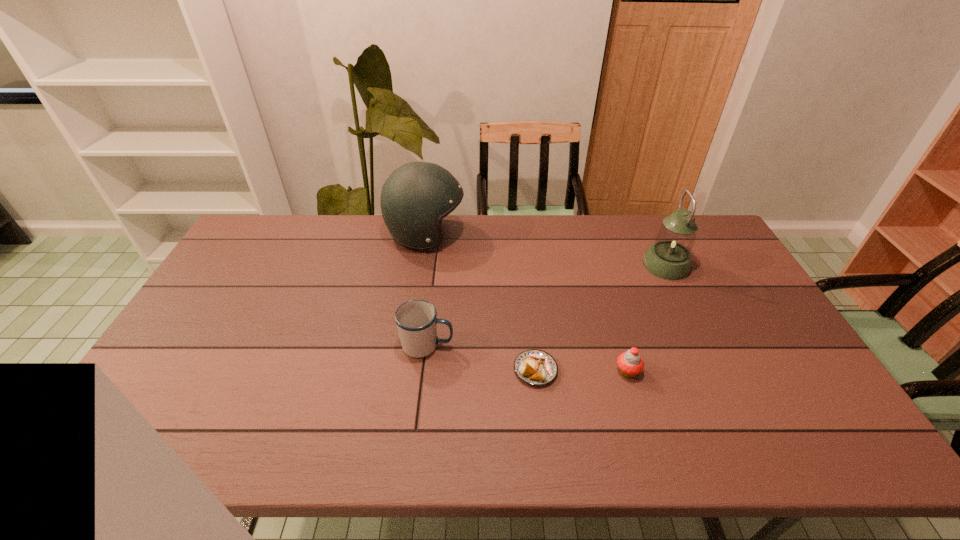
Where is `football helmet`? The height and width of the screenshot is (540, 960). football helmet is located at coordinates (415, 198).

The width and height of the screenshot is (960, 540). I want to click on lantern, so click(x=669, y=258).

Identify the location of mug. (416, 321).

What are the coordinates of `the fourth object from left to right` in the screenshot? It's located at click(630, 363).

Find the location of a particular element. The width and height of the screenshot is (960, 540). cupcake is located at coordinates (630, 363).

The width and height of the screenshot is (960, 540). Identify the location of the shortest object. (535, 367).

Identify the location of the third object from left to right. This screenshot has width=960, height=540. (535, 367).

Image resolution: width=960 pixels, height=540 pixels. In order to click on blank space located at the face opening of the football helmet in this screenshot , I will do `click(550, 235)`.

Locate an element on the screen. The width and height of the screenshot is (960, 540). vacant region located on the front of the rightmost object is located at coordinates (704, 343).

Identify the location of vacant space located 0.380m on the handle side of the third tallest object. tap(590, 345).